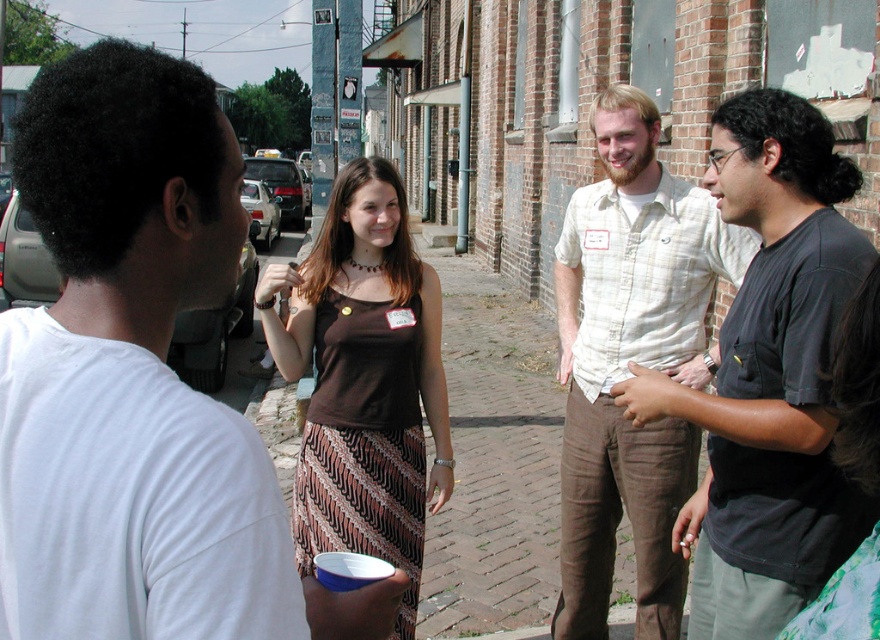
Which is more to the right, white matte t-shirt at left or light beige plaid shirt at center?

From the viewer's perspective, light beige plaid shirt at center appears more on the right side.

The width and height of the screenshot is (880, 640). I want to click on white matte t-shirt at left, so click(140, 380).

What are the coordinates of `white matte t-shirt at left` in the screenshot? It's located at (140, 380).

Which is more to the left, black cotton shirt at center or light beige plaid shirt at center?

From the viewer's perspective, light beige plaid shirt at center appears more on the left side.

Is point (770, 115) behind point (583, 564)?

No, it is in front of (583, 564).

You are a GUI agent. You are given a task and a screenshot of the screen. Output one action in this format:
    pyautogui.click(x=<x>, y=<y>)
    Task: Click on the black cotton shirt at center
    
    Given the screenshot: What is the action you would take?
    pyautogui.click(x=770, y=378)

Can you confirm if light beige plaid shirt at center is positioned above brown fabric dress at center?

No.

How far apart are light beige plaid shirt at center and brown fabric dress at center?

78.83 centimeters

Locate an element on the screen. The width and height of the screenshot is (880, 640). light beige plaid shirt at center is located at coordinates (631, 358).

Identify the location of light beige plaid shirt at center. The image size is (880, 640). (631, 358).